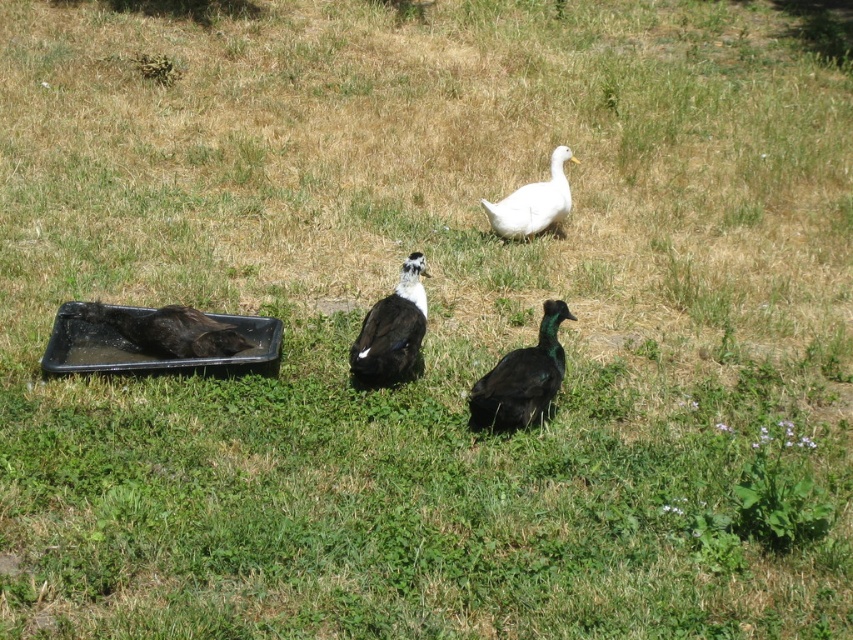
Consider the image. You are setting up a picnic and want to place a white matte duck at upper center and a black matte tray at left. Given their sizes, which object will take up more space on the picnic blanket?

The white matte duck at upper center occupies more space than the black matte tray at left because the black matte tray at left occupies less space than white matte duck at upper center.

You are a birdwatcher observing the ducks in the scene. Which duck, the black glossy duck at center or the white matte duck at upper center, is shorter in height?

The black glossy duck at center has a lesser height compared to the white matte duck at upper center, so the black glossy duck at center is shorter.